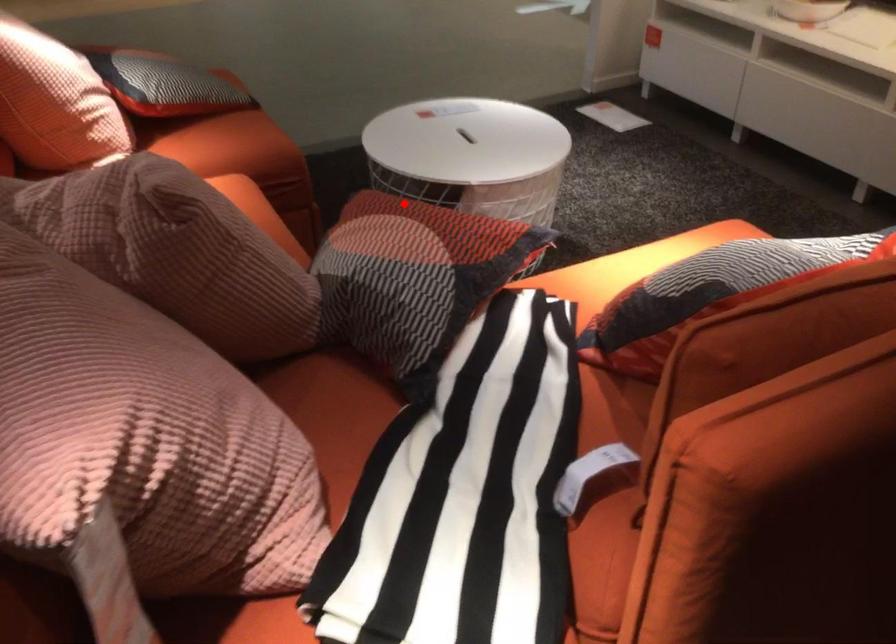
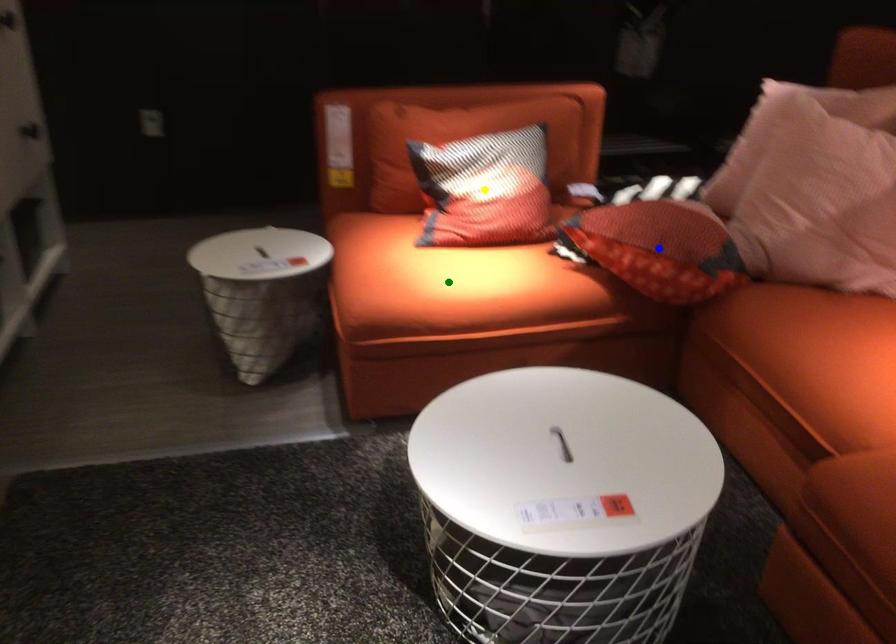
Question: I am providing you with two images of the same scene from different viewpoints. A red point is marked on the first image. You are given multiple points on the second image. Which point in image 2 is actually the same real-world point as the red point in image 1?

Choices:
 (A) green point
 (B) yellow point
 (C) blue point

Answer: (C)